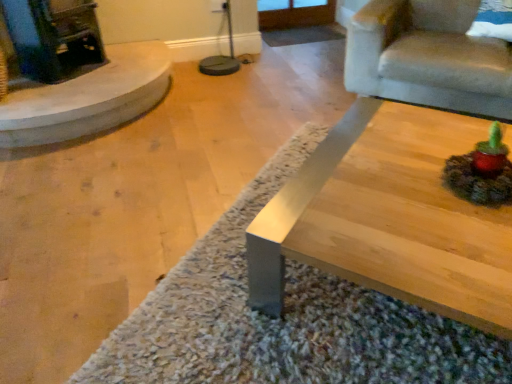
Question: Does velvet beige armchair at upper right appear on the right side of shaggy carpet at center?

Choices:
 (A) no
 (B) yes

Answer: (B)

Question: Is velvet beige armchair at upper right far away from shaggy carpet at center?

Choices:
 (A) no
 (B) yes

Answer: (B)

Question: From the image's perspective, would you say velvet beige armchair at upper right is shown under shaggy carpet at center?

Choices:
 (A) no
 (B) yes

Answer: (A)

Question: Is velvet beige armchair at upper right thinner than shaggy carpet at center?

Choices:
 (A) yes
 (B) no

Answer: (A)

Question: Can you confirm if velvet beige armchair at upper right is taller than shaggy carpet at center?

Choices:
 (A) yes
 (B) no

Answer: (A)

Question: Does velvet beige armchair at upper right lie behind shaggy carpet at center?

Choices:
 (A) yes
 (B) no

Answer: (A)

Question: Is smooth beige fireplace at left looking in the opposite direction of velvet beige armchair at upper right?

Choices:
 (A) yes
 (B) no

Answer: (B)

Question: Is smooth beige fireplace at left positioned behind velvet beige armchair at upper right?

Choices:
 (A) yes
 (B) no

Answer: (A)

Question: From a real-world perspective, is smooth beige fireplace at left located higher than velvet beige armchair at upper right?

Choices:
 (A) no
 (B) yes

Answer: (A)

Question: Is smooth beige fireplace at left next to velvet beige armchair at upper right?

Choices:
 (A) yes
 (B) no

Answer: (B)

Question: Considering the relative positions of smooth beige fireplace at left and velvet beige armchair at upper right in the image provided, is smooth beige fireplace at left to the right of velvet beige armchair at upper right from the viewer's perspective?

Choices:
 (A) no
 (B) yes

Answer: (A)

Question: Is smooth beige fireplace at left to the left of velvet beige armchair at upper right from the viewer's perspective?

Choices:
 (A) no
 (B) yes

Answer: (B)

Question: Considering the relative positions of shaggy carpet at center and velvet beige armchair at upper right in the image provided, is shaggy carpet at center in front of velvet beige armchair at upper right?

Choices:
 (A) yes
 (B) no

Answer: (A)